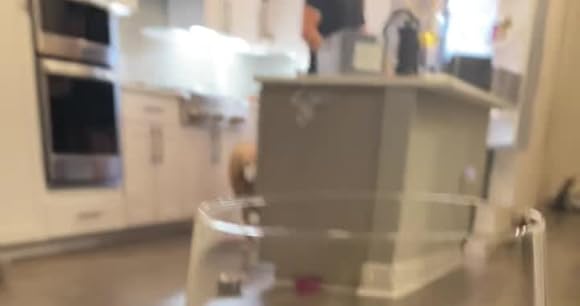
Identify the location of island surface. (369, 79).